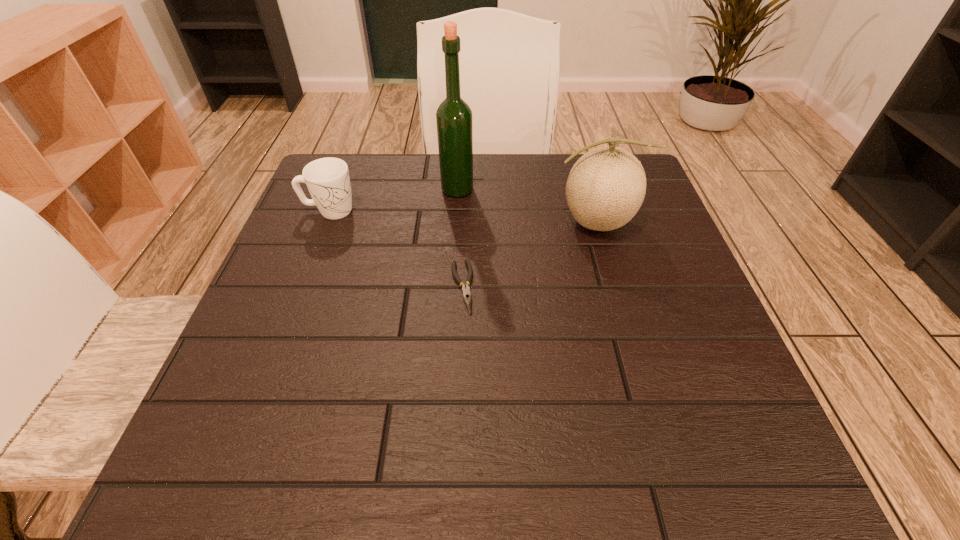
The width and height of the screenshot is (960, 540). What are the coordinates of `free spot at the left edge of the desktop` in the screenshot? It's located at coord(301,299).

In the image, there is a desktop. Identify the location of vacant space at the right edge. Image resolution: width=960 pixels, height=540 pixels. (628, 259).

Locate an element on the screen. vacant space at the far left corner of the desktop is located at coordinates (386, 156).

This screenshot has height=540, width=960. Find the location of `unoccupied area between the nearest object and the cantaloup`. unoccupied area between the nearest object and the cantaloup is located at coordinates (528, 255).

Image resolution: width=960 pixels, height=540 pixels. Identify the location of vacant space that is in between the tallest object and the rightmost object. (526, 206).

This screenshot has height=540, width=960. In order to click on free space between the pliers and the second shortest object in this screenshot , I will do `click(396, 249)`.

At what (x,y) coordinates should I click in order to perform the action: click on vacant space in between the liquor and the rightmost object. Please return your answer as a coordinate pair (x, y). The image size is (960, 540). Looking at the image, I should click on (526, 206).

Locate an element on the screen. Image resolution: width=960 pixels, height=540 pixels. free space that is in between the second tallest object and the second shortest object is located at coordinates (462, 217).

Locate an element on the screen. This screenshot has height=540, width=960. vacant region between the third tallest object and the nearest object is located at coordinates (396, 249).

At what (x,y) coordinates should I click in order to perform the action: click on free point between the third shortest object and the liquor. Please return your answer as a coordinate pair (x, y). The image size is (960, 540). Looking at the image, I should click on (526, 206).